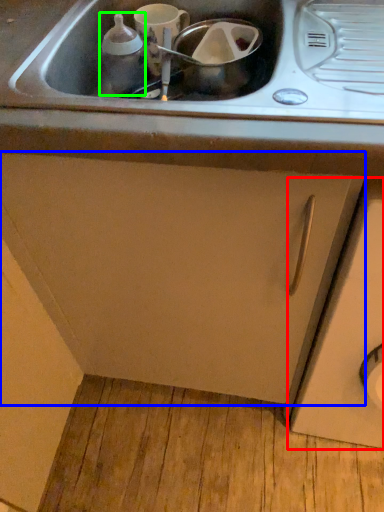
Question: Estimate the real-world distances between objects in this image. Which object is closer to cabinetry (highlighted by a red box), cabinetry (highlighted by a blue box) or bottle (highlighted by a green box)?

Choices:
 (A) cabinetry
 (B) bottle

Answer: (A)